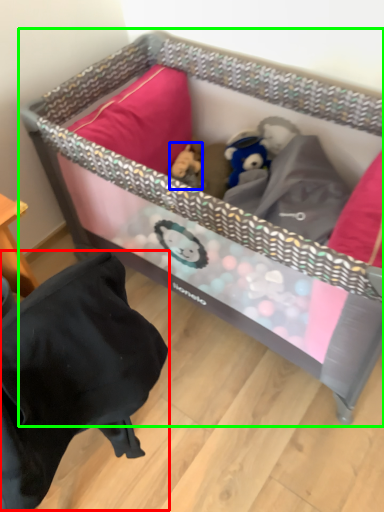
Question: Based on their relative distances, which object is farther from bean bag chair (highlighted by a red box)? Choose from toy (highlighted by a blue box) and infant bed (highlighted by a green box).

Choices:
 (A) toy
 (B) infant bed

Answer: (A)